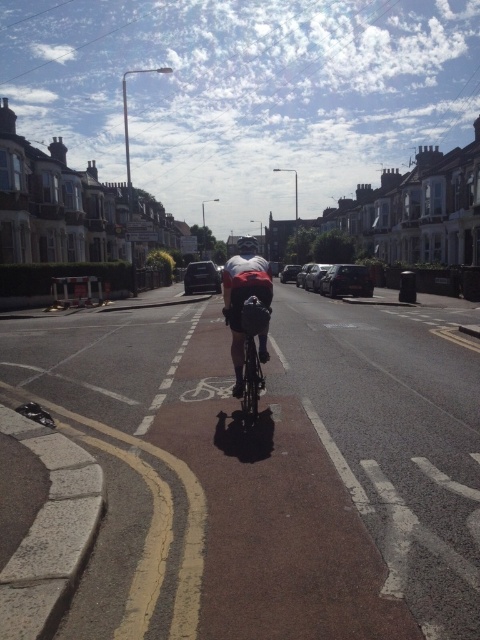
You are a pedestrian standing at the edge of the bike lane. You see the white fabric cyclist at center and the shiny metallic bicycle at center. Which object is closer to your right side?

The shiny metallic bicycle at center is closer to your right side because the white fabric cyclist at center is to the left of it.

You are a delivery person who needs to place a matte black helmet at center onto the brown asphalt bike lane at center. Considering their sizes, will the helmet fit entirely within the bike lane without overhanging?

The brown asphalt bike lane at center is wider than the matte black helmet at center, so the helmet will fit entirely within the bike lane without overhanging.